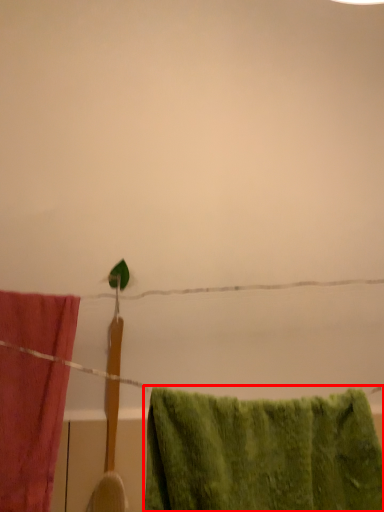
Question: In this image, where is towel (annotated by the red box) located relative to towel?

Choices:
 (A) left
 (B) right

Answer: (B)